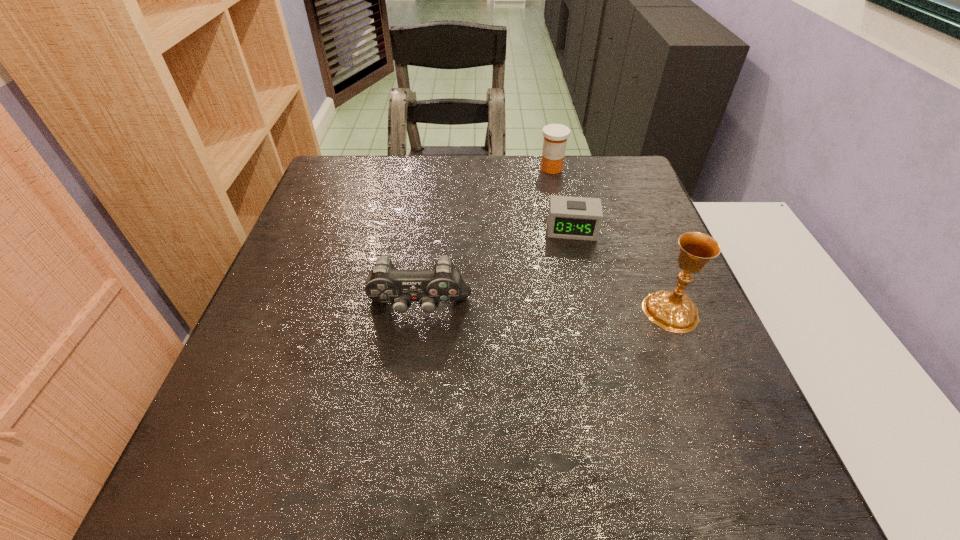
Where is `free space between the control and the second farthest object`? The image size is (960, 540). free space between the control and the second farthest object is located at coordinates (495, 269).

The width and height of the screenshot is (960, 540). Identify the location of vacant area that lies between the control and the medicine. (485, 239).

Locate an element on the screen. The image size is (960, 540). object that is the third closest to the control is located at coordinates pos(555,135).

The width and height of the screenshot is (960, 540). Find the location of `object that ranks as the second closest to the tallest object`. object that ranks as the second closest to the tallest object is located at coordinates (x=385, y=284).

This screenshot has width=960, height=540. Identify the location of free space that satisfies the following two spatial constraints: 1. on the surface of the leftmost object with buttons; 2. on the right side of the rightmost object. (419, 311).

The height and width of the screenshot is (540, 960). Identify the location of vacant space that satisfies the following two spatial constraints: 1. on the surface of the leftmost object with buttons; 2. on the right side of the chalice. (419, 311).